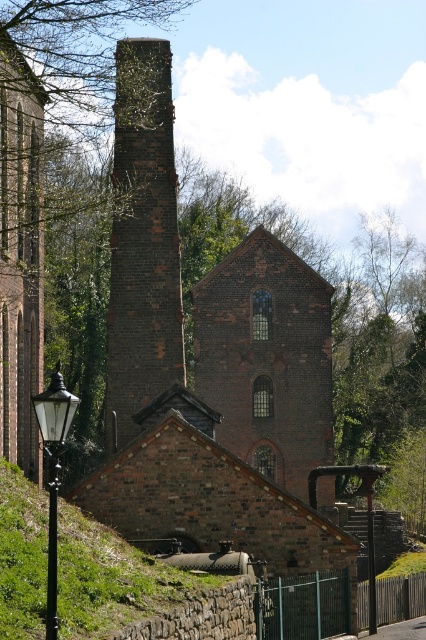
You are a drone operator trying to capture a photo of the historic brick structure. You need to position your drone so that it is directly above the green grassy hillside at lower left. What are the coordinates you should set for the drone?

→ The coordinates for the green grassy hillside at lower left are 0.905 on the x axis and 0.263 on the y axis, so the drone should be set to those coordinates to be directly above it.

Based on the photo, you are standing in front of the historic brick structure. You notice the dark brown brick chimney at center and the green grassy hillside at lower left. Which object is closer to you?

The dark brown brick chimney at center is closer to you than the green grassy hillside at lower left.

You are a delivery person trying to navigate to the historic brick structure. You see the green grassy hillside at lower left and the black glass lamp post at lower left. Which object is closer to the ground?

The green grassy hillside at lower left is positioned under the black glass lamp post at lower left, meaning it is closer to the ground.